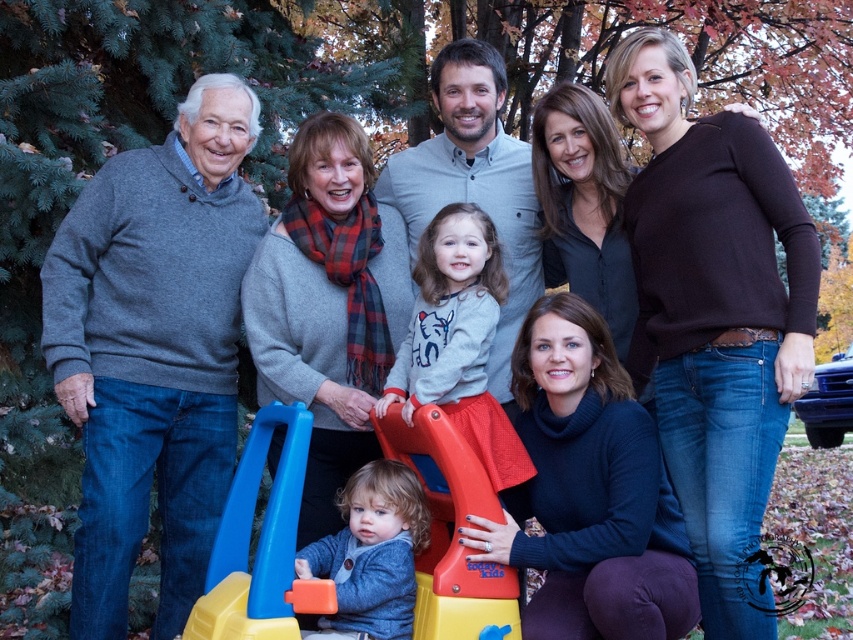
You are a parent trying to organize your children for a game. You have a blue plastic toy at lower left and a red plastic slide at lower center. Which object is positioned higher from the ground?

The blue plastic toy at lower left is positioned higher from the ground than the red plastic slide at lower center because it is above it.

Based on the photo, you are standing 10 feet away from the point at coordinates point (68,346). If you move forward 5 feet, will you be closer to or farther from the point?

The distance of point (68,346) from viewer is 14.33 feet. Moving forward 5 feet from your current position 10 feet away will bring you to 15.33 feet away from the point, so you will be farther from the point.

In the scene shown: You are standing in front of the family photo taken during autumn. There are two points marked in the image. The first point is at coordinate (463, 636) and the second is at (392, 627). Which point is closer to you?

Point (463, 636) is closer to you than point (392, 627).